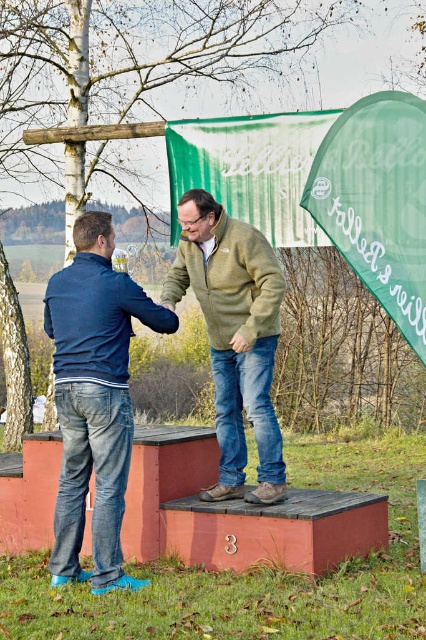
Question: Observing the image, what is the correct spatial positioning of blue denim jeans at lower left in reference to green fuzzy sweater at center?

Choices:
 (A) above
 (B) below

Answer: (B)

Question: Which point is closer to the camera taking this photo?

Choices:
 (A) (126, 451)
 (B) (253, 349)

Answer: (A)

Question: Observing the image, what is the correct spatial positioning of blue denim jeans at lower left in reference to green fuzzy sweater at center?

Choices:
 (A) below
 (B) above

Answer: (A)

Question: Does blue denim jeans at lower left appear on the right side of green fuzzy sweater at center?

Choices:
 (A) no
 (B) yes

Answer: (A)

Question: Among these objects, which one is nearest to the camera?

Choices:
 (A) green fuzzy sweater at center
 (B) blue denim jeans at lower left

Answer: (B)